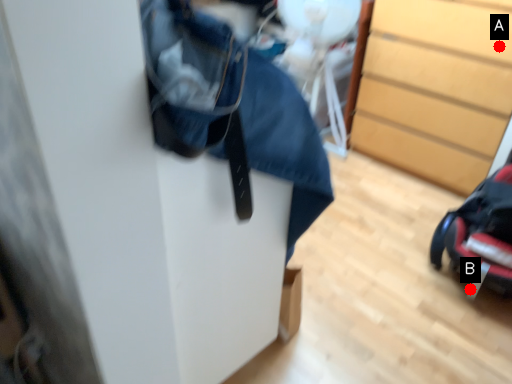
Question: Two points are circled on the image, labeled by A and B beside each circle. Which point is farther from the camera taking this photo?

Choices:
 (A) A is further
 (B) B is further

Answer: (A)